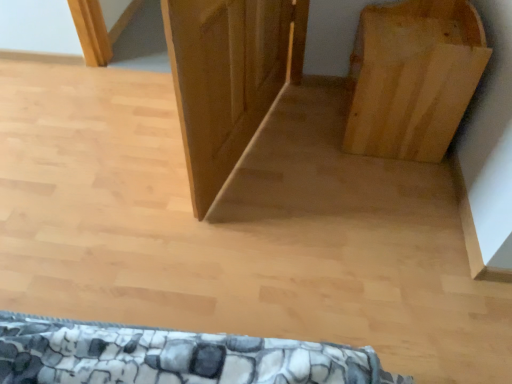
Question: Relative to natural wood bookshelf at right, is wooden door at center in front or behind?

Choices:
 (A) front
 (B) behind

Answer: (A)

Question: Considering the positions of wooden door at center and natural wood bookshelf at right in the image, is wooden door at center taller or shorter than natural wood bookshelf at right?

Choices:
 (A) short
 (B) tall

Answer: (B)

Question: Is wooden door at center bigger or smaller than natural wood bookshelf at right?

Choices:
 (A) small
 (B) big

Answer: (A)

Question: Considering the positions of natural wood bookshelf at right and wooden door at center in the image, is natural wood bookshelf at right wider or thinner than wooden door at center?

Choices:
 (A) thin
 (B) wide

Answer: (B)

Question: From their relative heights in the image, would you say natural wood bookshelf at right is taller or shorter than wooden door at center?

Choices:
 (A) short
 (B) tall

Answer: (A)

Question: From the image's perspective, relative to wooden door at center, is natural wood bookshelf at right above or below?

Choices:
 (A) below
 (B) above

Answer: (B)

Question: Is natural wood bookshelf at right to the left or to the right of wooden door at center in the image?

Choices:
 (A) left
 (B) right

Answer: (B)